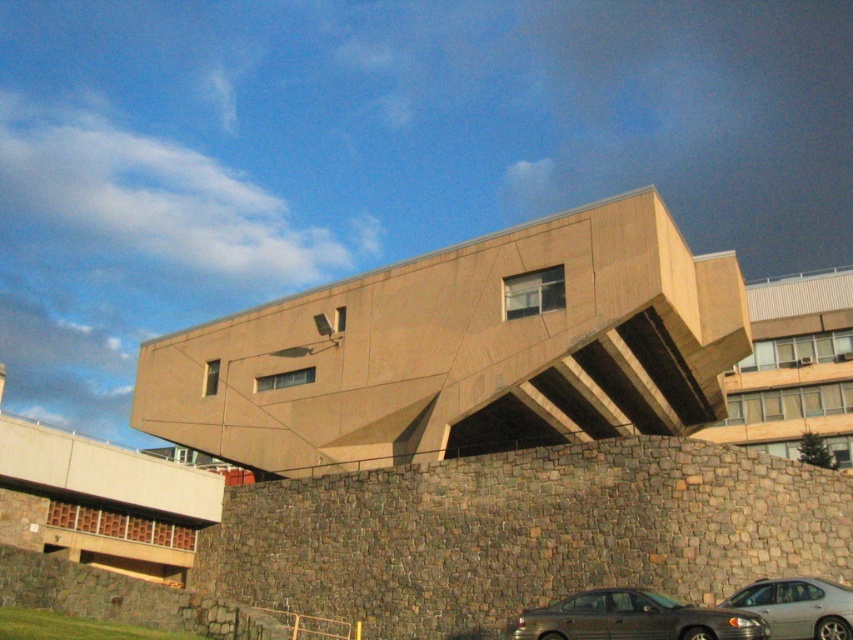
Question: Does metallic gray sedan at lower right appear over silver metallic sedan at lower right?

Choices:
 (A) yes
 (B) no

Answer: (B)

Question: Which of these objects is positioned farthest from the metallic gray sedan at lower right?

Choices:
 (A) silver metallic sedan at lower right
 (B) beige stone building at upper center

Answer: (B)

Question: Which object is closer to the camera taking this photo?

Choices:
 (A) metallic gray sedan at lower right
 (B) silver metallic sedan at lower right

Answer: (A)

Question: Can you confirm if beige concrete building at center is thinner than beige stone building at upper center?

Choices:
 (A) yes
 (B) no

Answer: (A)

Question: Does beige stone building at upper center appear over silver metallic sedan at lower right?

Choices:
 (A) yes
 (B) no

Answer: (A)

Question: Estimate the real-world distances between objects in this image. Which object is closer to the silver metallic sedan at lower right?

Choices:
 (A) beige stone building at upper center
 (B) metallic gray sedan at lower right

Answer: (B)